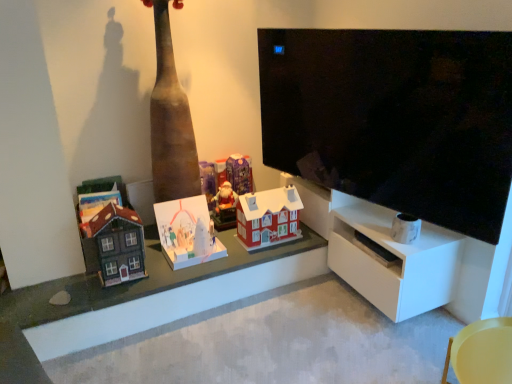
Where is `free location in front of white matte shelf at right`? Image resolution: width=512 pixels, height=384 pixels. free location in front of white matte shelf at right is located at coordinates (385, 345).